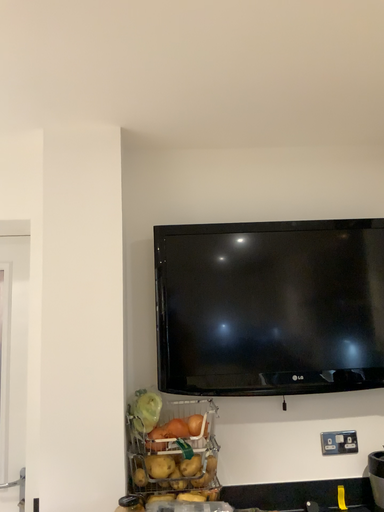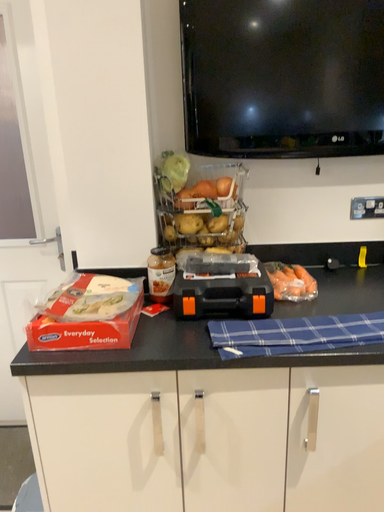
Question: Which way did the camera rotate in the video?

Choices:
 (A) rotated downward
 (B) rotated upward

Answer: (A)